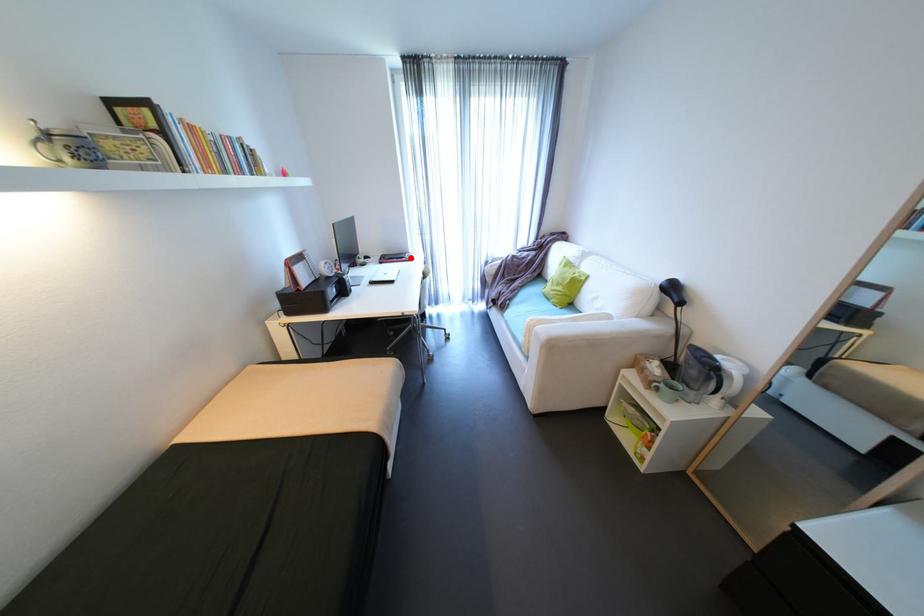
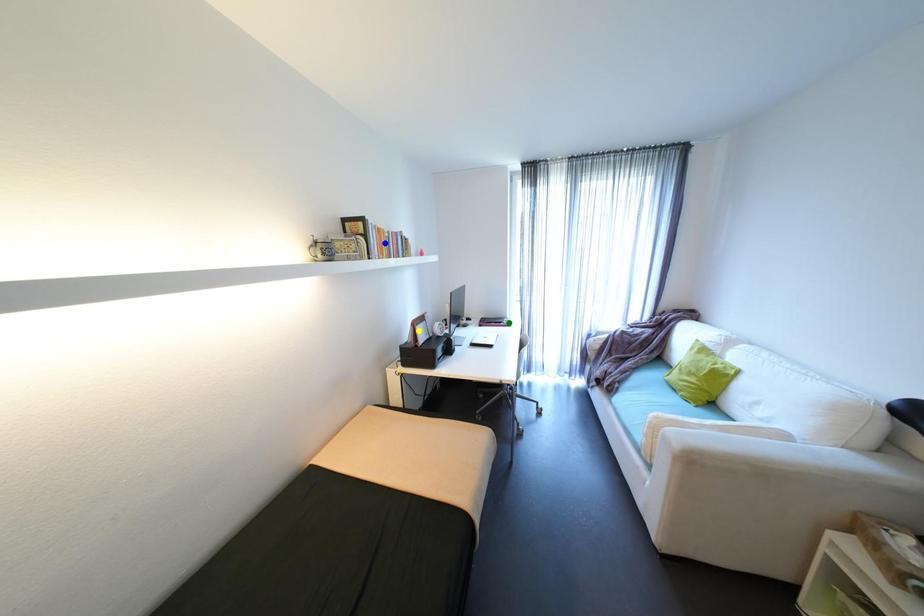
Question: I am providing you with two images of the same scene from different viewpoints. A red point is marked on the first image. You are given multiple points on the second image. Which point in image 2 represents the same 3d spot as the red point in image 1?

Choices:
 (A) yellow point
 (B) blue point
 (C) green point

Answer: (C)